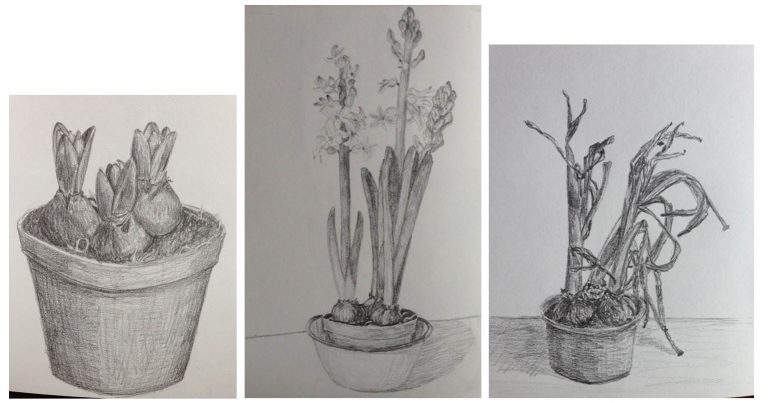
Identify the location of tall skinny plant. Image resolution: width=768 pixels, height=403 pixels. (343, 201), (396, 144).